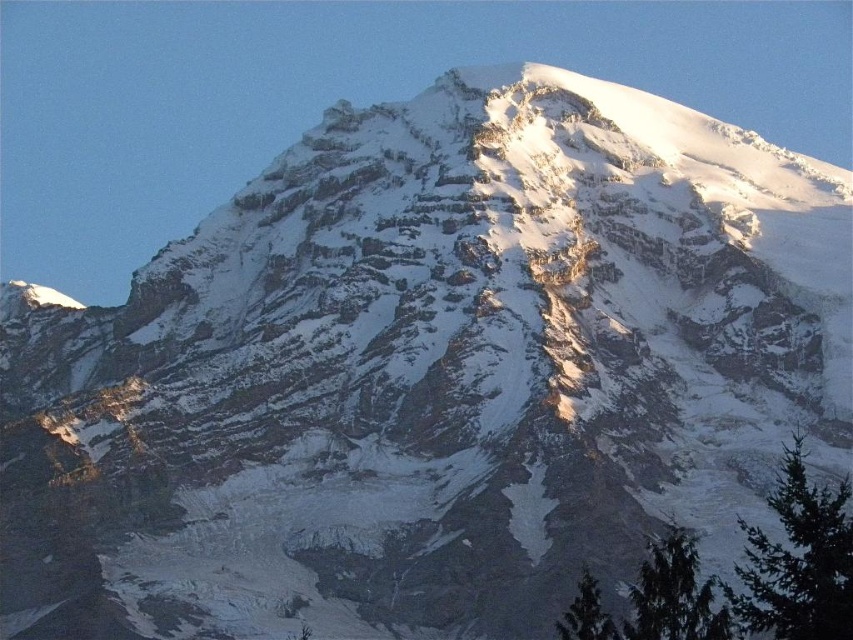
Question: Is green matte tree at lower right positioned before green textured tree at lower right?

Choices:
 (A) no
 (B) yes

Answer: (B)

Question: Can you confirm if green matte tree at lower right is positioned to the left of green textured tree at lower right?

Choices:
 (A) no
 (B) yes

Answer: (A)

Question: Which object appears closest to the camera in this image?

Choices:
 (A) green textured evergreen at lower right
 (B) green matte tree at lower right

Answer: (A)

Question: Does green textured evergreen at lower right have a smaller size compared to green textured tree at lower right?

Choices:
 (A) yes
 (B) no

Answer: (B)

Question: Which object is positioned farthest from the green textured evergreen at lower right?

Choices:
 (A) green matte tree at lower right
 (B) green textured tree at lower right

Answer: (B)

Question: Which object is the closest to the green textured tree at lower right?

Choices:
 (A) green textured evergreen at lower right
 (B) green matte tree at lower right

Answer: (B)